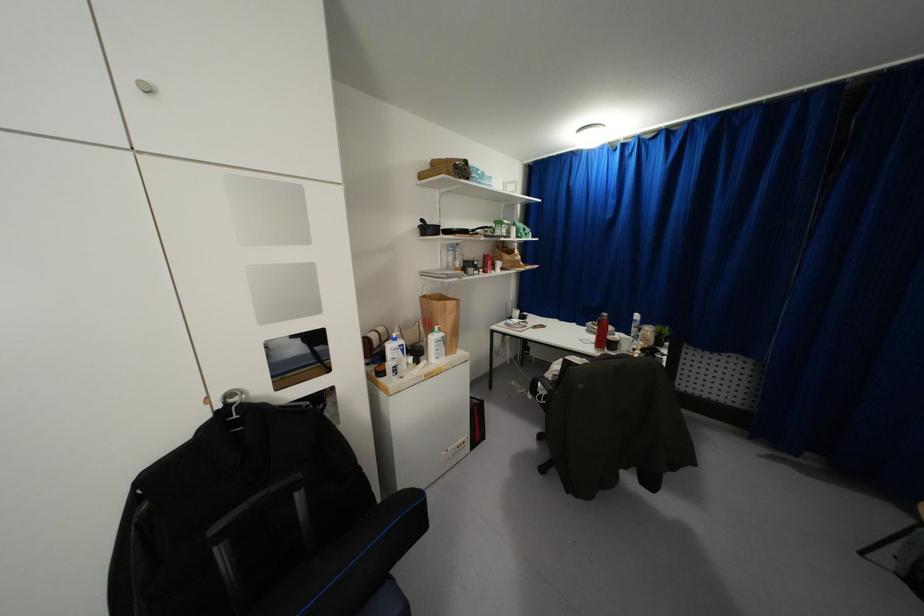
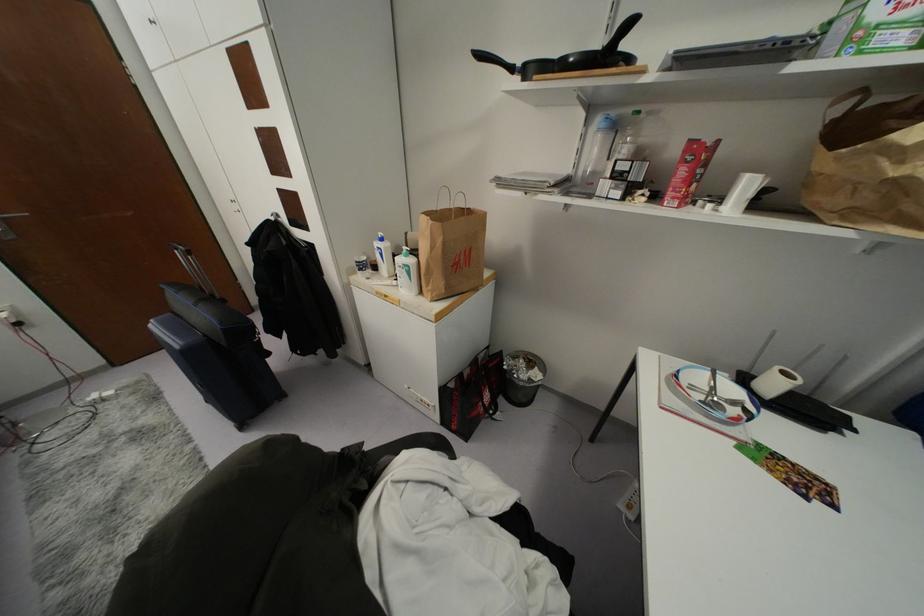
Locate, in the second image, the point that corresponds to pixel 402 350 in the first image.

(381, 254)